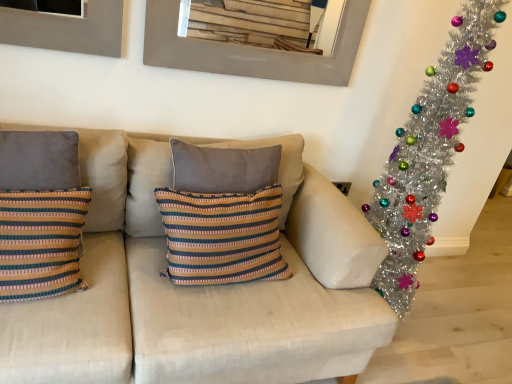
Question: Does striped fabric pillow at left, arranged as the second pillow when viewed from the right, have a larger size compared to metallic gray picture frame at upper center?

Choices:
 (A) yes
 (B) no

Answer: (B)

Question: Is striped fabric pillow at left, the first pillow viewed from the left, beside metallic gray picture frame at upper center?

Choices:
 (A) yes
 (B) no

Answer: (B)

Question: Considering the relative positions of striped fabric pillow at left, arranged as the second pillow when viewed from the right, and metallic gray picture frame at upper center in the image provided, is striped fabric pillow at left, arranged as the second pillow when viewed from the right, to the left of metallic gray picture frame at upper center from the viewer's perspective?

Choices:
 (A) yes
 (B) no

Answer: (A)

Question: Is striped fabric pillow at left, arranged as the second pillow when viewed from the right, surrounding metallic gray picture frame at upper center?

Choices:
 (A) yes
 (B) no

Answer: (B)

Question: From a real-world perspective, is striped fabric pillow at left, the first pillow viewed from the left, physically below metallic gray picture frame at upper center?

Choices:
 (A) no
 (B) yes

Answer: (B)

Question: Considering the relative sizes of striped fabric pillow at left, the first pillow viewed from the left, and metallic gray picture frame at upper center in the image provided, is striped fabric pillow at left, the first pillow viewed from the left, thinner than metallic gray picture frame at upper center?

Choices:
 (A) yes
 (B) no

Answer: (B)

Question: Does shiny silver tinsel garland at right have a lesser height compared to striped fabric pillow at left, arranged as the second pillow when viewed from the right?

Choices:
 (A) no
 (B) yes

Answer: (A)

Question: From a real-world perspective, is shiny silver tinsel garland at right on top of striped fabric pillow at left, the first pillow viewed from the left?

Choices:
 (A) no
 (B) yes

Answer: (B)

Question: Does shiny silver tinsel garland at right touch striped fabric pillow at left, the first pillow viewed from the left?

Choices:
 (A) yes
 (B) no

Answer: (B)

Question: Is shiny silver tinsel garland at right to the right of striped fabric pillow at left, the first pillow viewed from the left, from the viewer's perspective?

Choices:
 (A) yes
 (B) no

Answer: (A)

Question: Can you confirm if shiny silver tinsel garland at right is taller than striped fabric pillow at left, the first pillow viewed from the left?

Choices:
 (A) yes
 (B) no

Answer: (A)

Question: Does shiny silver tinsel garland at right have a smaller size compared to striped fabric pillow at left, arranged as the second pillow when viewed from the right?

Choices:
 (A) yes
 (B) no

Answer: (B)

Question: Does striped fabric pillow at left, arranged as the second pillow when viewed from the right, have a lesser width compared to textured beige couch at center?

Choices:
 (A) no
 (B) yes

Answer: (B)